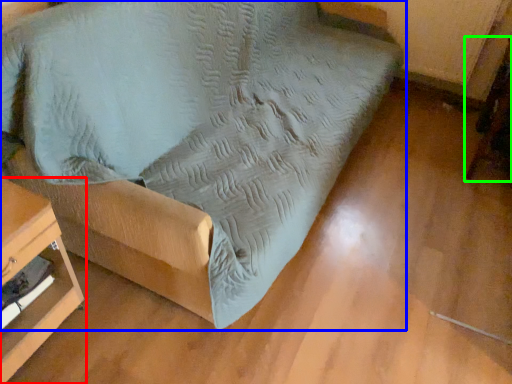
Question: Which object is the farthest from furniture (highlighted by a red box)? Choose among these: furniture (highlighted by a blue box) or swivel chair (highlighted by a green box).

Choices:
 (A) furniture
 (B) swivel chair

Answer: (B)